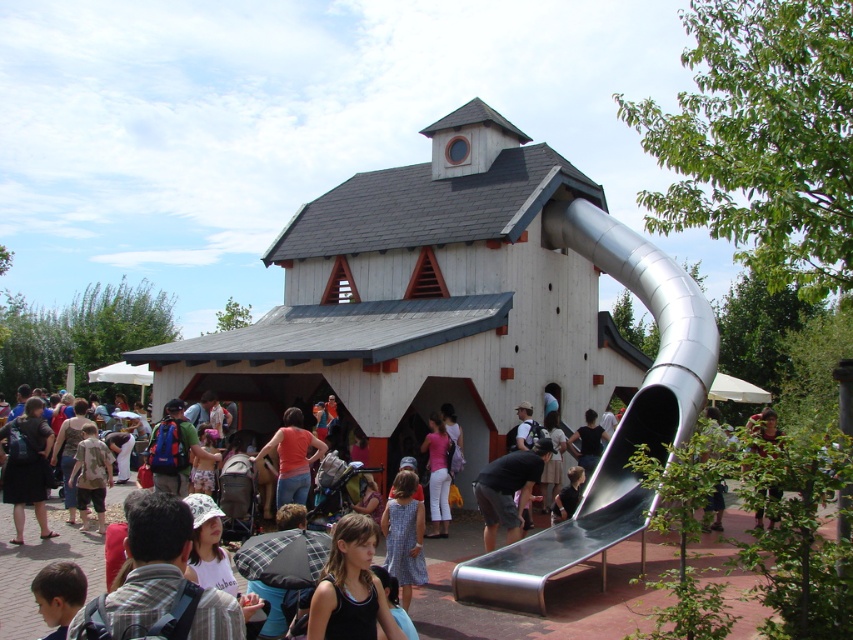
You are a photographer standing at the edge of the playground. You want to take a photo that includes both the dark gray fabric shirt at center and the green leafy tree at lower right. Which object should you adjust your camera focus to first to ensure both are in the frame?

The dark gray fabric shirt at center is closer to the photographer than the green leafy tree at lower right. To ensure both are in the frame, focus on the dark gray fabric shirt at center first, as it is nearer, and adjust the zoom or framing to include the tree in the background.

You are a park visitor holding a 100 feet long banner that needs to be displayed between the green leafy tree at lower right and the matte black shirt at lower center. Can the banner stretch between them without any issues?

The distance between the green leafy tree at lower right and the matte black shirt at lower center is 50.48 feet, so the banner can easily stretch between them since it is twice as long as the required distance.